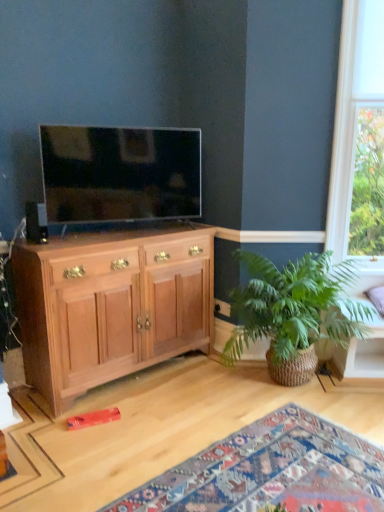
At what (x,y) coordinates should I click in order to perform the action: click on green woven basket at right. Please return your answer as a coordinate pair (x, y). The height and width of the screenshot is (512, 384). Looking at the image, I should click on (294, 312).

Locate an element on the screen. Image resolution: width=384 pixels, height=512 pixels. wooden cabinet at center is located at coordinates (174, 426).

Is wooden cabinet at center looking in the opposite direction of wooden cabinet at left?

That's not correct — wooden cabinet at center is not looking away from wooden cabinet at left.

How many degrees apart are the facing directions of wooden cabinet at center and wooden cabinet at left?

The facing directions of wooden cabinet at center and wooden cabinet at left are 0.579 degrees apart.

Who is taller, wooden cabinet at center or wooden cabinet at left?

Standing taller between the two is wooden cabinet at left.

Based on the photo, how far apart are wooden cabinet at center and wooden cabinet at left?

19.36 inches.

Which of these two, matte black speaker at left or wooden toy at lower left, stands taller?

matte black speaker at left.

From a real-world perspective, which is physically below, matte black speaker at left or wooden toy at lower left?

wooden toy at lower left.

Would you say matte black speaker at left is inside or outside wooden toy at lower left?

matte black speaker at left is located beyond the bounds of wooden toy at lower left.

Is point (26, 204) closer to camera compared to point (264, 462)?

No, (26, 204) is behind (264, 462).

How much distance is there between wooden cabinet at center and matte black speaker at left?

wooden cabinet at center and matte black speaker at left are 1.31 meters apart.

From the image's perspective, would you say wooden cabinet at center is shown under matte black speaker at left?

Yes, from the image's perspective, wooden cabinet at center is below matte black speaker at left.

Would you say wooden cabinet at center is outside matte black speaker at left?

Yes, wooden cabinet at center is not within matte black speaker at left.

Could you tell me if wooden cabinet at center is facing matte black speaker at left?

No, wooden cabinet at center is not turned towards matte black speaker at left.

Between matte black tv at upper left and wooden cabinet at center, which one has smaller size?

matte black tv at upper left is smaller.

Is matte black tv at upper left directly adjacent to wooden cabinet at center?

matte black tv at upper left and wooden cabinet at center are clearly separated.

Considering the points (83, 173) and (48, 455), which point is behind, point (83, 173) or point (48, 455)?

The point (83, 173) is more distant.

Is wooden cabinet at center inside matte black tv at upper left?

No, matte black tv at upper left does not contain wooden cabinet at center.

Considering the relative sizes of wooden toy at lower left and matte black speaker at left in the image provided, is wooden toy at lower left shorter than matte black speaker at left?

Yes, wooden toy at lower left is shorter than matte black speaker at left.

Is wooden toy at lower left oriented away from matte black speaker at left?

wooden toy at lower left is not turned away from matte black speaker at left.

I want to click on plain directly beneath the matte black speaker at left (from a real-world perspective), so click(271, 471).

Which object is closer to the camera, wooden toy at lower left or matte black speaker at left?

wooden toy at lower left is in front.

Which object is wider, wooden cabinet at left or matte black tv at upper left?

With larger width is wooden cabinet at left.

Is wooden cabinet at left spatially inside matte black tv at upper left, or outside of it?

wooden cabinet at left is spatially situated outside matte black tv at upper left.

Which object is closer to the camera, wooden cabinet at left or matte black tv at upper left?

Positioned in front is wooden cabinet at left.

Find the location of a particular element. Image resolution: width=384 pixels, height=512 pixels. houseplant lying below the wooden cabinet at left (from the image's perspective) is located at coordinates (294, 312).

Considering the relative sizes of green woven basket at right and wooden cabinet at left in the image provided, is green woven basket at right shorter than wooden cabinet at left?

Indeed, green woven basket at right has a lesser height compared to wooden cabinet at left.

Can we say green woven basket at right lies outside wooden cabinet at left?

Yes, green woven basket at right is located beyond the bounds of wooden cabinet at left.

Does green woven basket at right have a greater width compared to wooden cabinet at left?

Indeed, green woven basket at right has a greater width compared to wooden cabinet at left.

Where is `desk in front of the wooden cabinet at left`? desk in front of the wooden cabinet at left is located at coordinates (174, 426).

Where is `loudspeaker above the wooden toy at lower left (from a real-world perspective)`? Image resolution: width=384 pixels, height=512 pixels. loudspeaker above the wooden toy at lower left (from a real-world perspective) is located at coordinates (36, 222).

Considering their positions, is wooden cabinet at center positioned closer to wooden toy at lower left than wooden cabinet at left?

wooden cabinet at center.

Looking at the image, which one is located closer to wooden toy at lower left, wooden cabinet at center or matte black tv at upper left?

The object closer to wooden toy at lower left is wooden cabinet at center.

Estimate the real-world distances between objects in this image. Which object is further from wooden cabinet at left, matte black tv at upper left or wooden cabinet at center?

matte black tv at upper left.

From the image, which object appears to be farther from wooden cabinet at left, matte black speaker at left or wooden toy at lower left?

Among the two, wooden toy at lower left is located further to wooden cabinet at left.

Looking at the image, which one is located further to green woven basket at right, wooden cabinet at left or matte black tv at upper left?

Based on the image, matte black tv at upper left appears to be further to green woven basket at right.

Based on their spatial positions, is matte black speaker at left or wooden cabinet at center further from wooden toy at lower left?

Based on the image, matte black speaker at left appears to be further to wooden toy at lower left.

From the picture: Based on their spatial positions, is green woven basket at right or wooden toy at lower left further from wooden cabinet at center?

green woven basket at right is positioned further to the anchor wooden cabinet at center.

Estimate the real-world distances between objects in this image. Which object is further from wooden toy at lower left, matte black tv at upper left or wooden cabinet at left?

matte black tv at upper left is further to wooden toy at lower left.

Where is `plain between wooden cabinet at center and matte black speaker at left in the front-back direction`? Image resolution: width=384 pixels, height=512 pixels. plain between wooden cabinet at center and matte black speaker at left in the front-back direction is located at coordinates coord(271,471).

This screenshot has width=384, height=512. What are the coordinates of `television between matte black speaker at left and green woven basket at right in the horizontal direction` in the screenshot? It's located at (120, 173).

Where is `plain between wooden cabinet at center and green woven basket at right in the front-back direction`? plain between wooden cabinet at center and green woven basket at right in the front-back direction is located at coordinates (271, 471).

In order to click on desk between matte black speaker at left and green woven basket at right in the horizontal direction in this screenshot , I will do `click(174, 426)`.